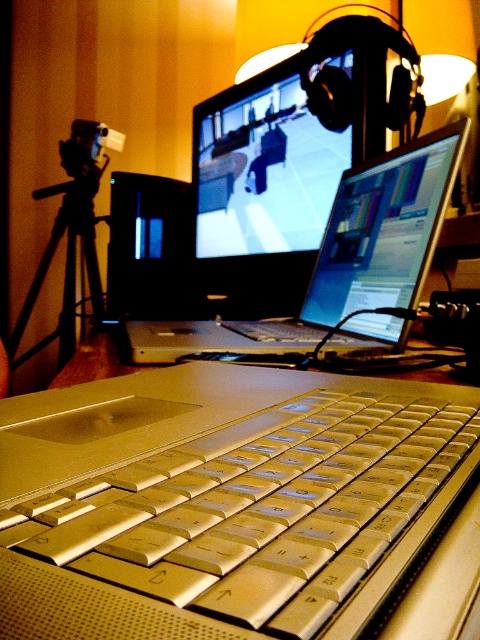
Question: Which of these objects is positioned farthest from the black matte tripod at left?

Choices:
 (A) silver metallic keyboard at center
 (B) silver plastic video camera at left

Answer: (A)

Question: Can you confirm if black matte tripod at left is positioned to the left of silver plastic video camera at left?

Choices:
 (A) no
 (B) yes

Answer: (B)

Question: Which point is farther from the camera taking this photo?

Choices:
 (A) (379, 291)
 (B) (468, 412)

Answer: (A)

Question: Is silver metallic laptop at center positioned at the back of black matte tripod at left?

Choices:
 (A) yes
 (B) no

Answer: (B)

Question: Does silver metallic keyboard at center come in front of silver plastic video camera at left?

Choices:
 (A) yes
 (B) no

Answer: (A)

Question: Which of the following is the farthest from the observer?

Choices:
 (A) silver metallic keyboard at center
 (B) silver plastic video camera at left

Answer: (B)